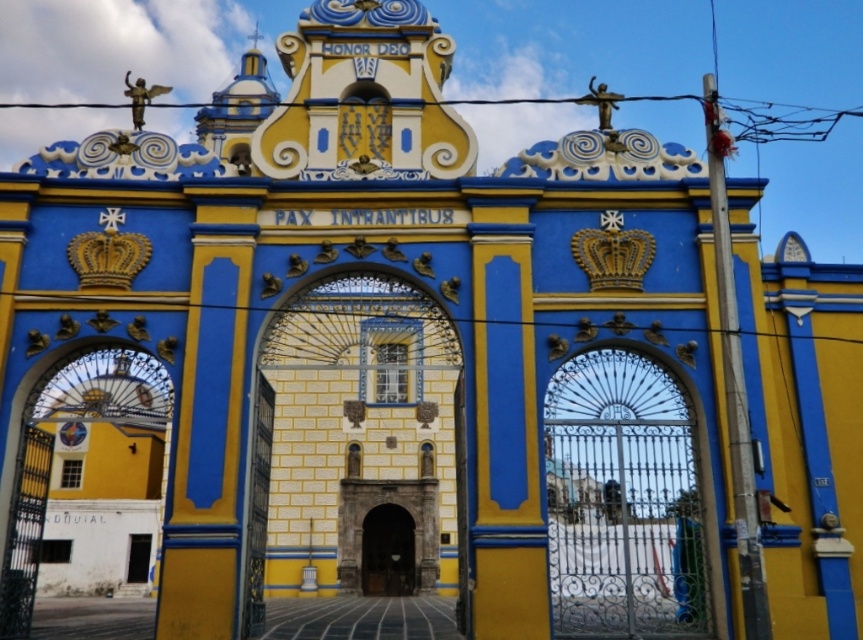
You are standing at the entrance of the grand gate and see both the smooth wood door at center and the dark wood door at center. Which door is closer to you?

The smooth wood door at center is closer to you since it is only 34.02 meters away from the dark wood door at center, implying the smooth wood door is nearer.

You are standing in front of the entrance gate and want to determine the relative positions of two points marked on the gate. Which point is closer to you, point (255, 518) or point (394, 577)?

Point (255, 518) is closer to the viewer than point (394, 577).